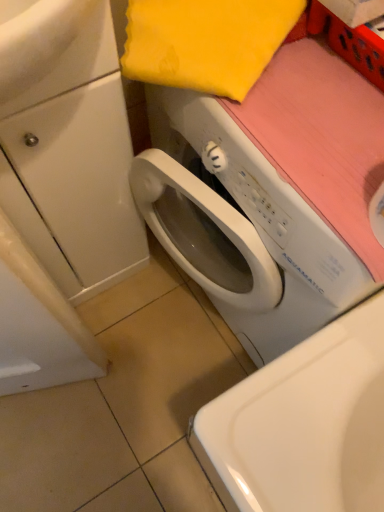
Question: Can you confirm if white plastic washing machine at center is thinner than white glossy sink at upper left?

Choices:
 (A) yes
 (B) no

Answer: (B)

Question: From the image's perspective, is white plastic washing machine at center located beneath white glossy sink at upper left?

Choices:
 (A) no
 (B) yes

Answer: (B)

Question: Are white plastic washing machine at center and white glossy sink at upper left beside each other?

Choices:
 (A) no
 (B) yes

Answer: (A)

Question: Is white plastic washing machine at center not inside white glossy sink at upper left?

Choices:
 (A) no
 (B) yes

Answer: (B)

Question: Can you confirm if white plastic washing machine at center is positioned to the left of white glossy sink at upper left?

Choices:
 (A) no
 (B) yes

Answer: (A)

Question: Does white plastic washing machine at center have a lesser height compared to white glossy sink at upper left?

Choices:
 (A) no
 (B) yes

Answer: (A)

Question: Is white glossy sink at upper left positioned far away from white glossy cabinet at left?

Choices:
 (A) yes
 (B) no

Answer: (B)

Question: Is white glossy sink at upper left next to white glossy cabinet at left and touching it?

Choices:
 (A) no
 (B) yes

Answer: (A)

Question: Does white glossy sink at upper left have a greater height compared to white glossy cabinet at left?

Choices:
 (A) yes
 (B) no

Answer: (B)

Question: From the image's perspective, does white glossy sink at upper left appear lower than white glossy cabinet at left?

Choices:
 (A) yes
 (B) no

Answer: (B)

Question: Does white glossy sink at upper left have a lesser height compared to white glossy cabinet at left?

Choices:
 (A) no
 (B) yes

Answer: (B)

Question: From a real-world perspective, is white glossy sink at upper left on top of white glossy cabinet at left?

Choices:
 (A) yes
 (B) no

Answer: (A)

Question: Does white glossy cabinet at left have a lesser width compared to white plastic washing machine at center?

Choices:
 (A) yes
 (B) no

Answer: (A)